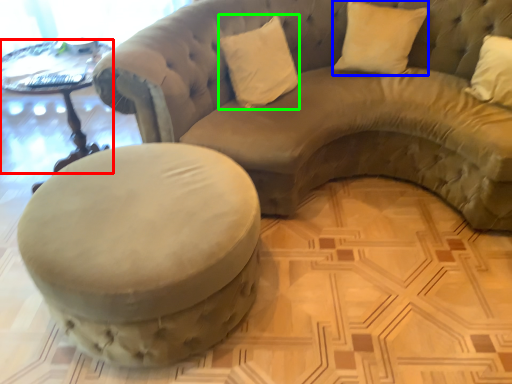
Question: Which object is the farthest from table (highlighted by a red box)? Choose among these: pillow (highlighted by a blue box) or pillow (highlighted by a green box).

Choices:
 (A) pillow
 (B) pillow

Answer: (A)